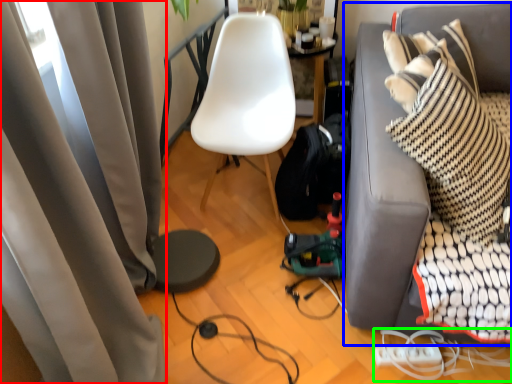
Question: Which object is positioned farthest from curtain (highlighted by a red box)? Select from studio couch (highlighted by a blue box) and cable (highlighted by a green box).

Choices:
 (A) studio couch
 (B) cable

Answer: (B)